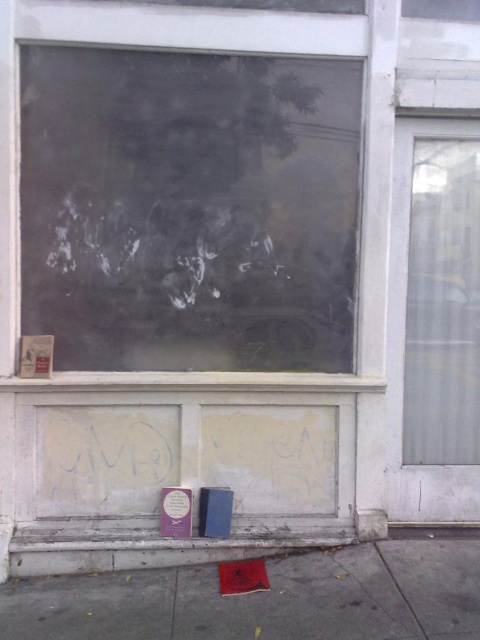
Is point (477, 278) closer to viewer compared to point (74, 17)?

No, (477, 278) is behind (74, 17).

Which is more to the left, transparent glass window at right or transparent glass window at center?

transparent glass window at center is more to the left.

Where is `transparent glass window at right`? transparent glass window at right is located at coordinates (437, 289).

Where is `transparent glass window at right`? transparent glass window at right is located at coordinates (437, 289).

The height and width of the screenshot is (640, 480). Describe the element at coordinates (264, 598) in the screenshot. I see `smooth concrete pavement at lower center` at that location.

Consider the image. Who is shorter, smooth concrete pavement at lower center or transparent glass window at center?

With less height is smooth concrete pavement at lower center.

Describe the element at coordinates (264, 598) in the screenshot. This screenshot has height=640, width=480. I see `smooth concrete pavement at lower center` at that location.

I want to click on smooth concrete pavement at lower center, so click(x=264, y=598).

What are the coordinates of `smooth concrete pavement at lower center` in the screenshot? It's located at (264, 598).